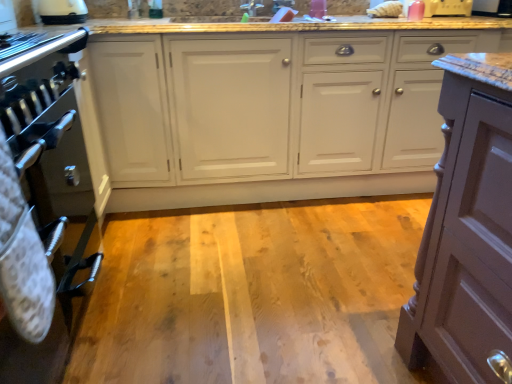
Question: Is metallic oven at left not close to white glossy faucet at upper center?

Choices:
 (A) yes
 (B) no

Answer: (A)

Question: Is metallic oven at left bigger than white glossy faucet at upper center?

Choices:
 (A) no
 (B) yes

Answer: (B)

Question: Does metallic oven at left have a lesser height compared to white glossy faucet at upper center?

Choices:
 (A) no
 (B) yes

Answer: (A)

Question: Could you tell me if metallic oven at left is turned towards white glossy faucet at upper center?

Choices:
 (A) no
 (B) yes

Answer: (A)

Question: From the image's perspective, is metallic oven at left on top of white glossy faucet at upper center?

Choices:
 (A) no
 (B) yes

Answer: (A)

Question: Is metallic oven at left completely or partially outside of white glossy faucet at upper center?

Choices:
 (A) yes
 (B) no

Answer: (A)

Question: Is white glossy cabinets at center not near wooden floor at center?

Choices:
 (A) no
 (B) yes

Answer: (A)

Question: Is white glossy cabinets at center positioned behind wooden floor at center?

Choices:
 (A) yes
 (B) no

Answer: (A)

Question: Considering the relative sizes of white glossy cabinets at center and wooden floor at center in the image provided, is white glossy cabinets at center bigger than wooden floor at center?

Choices:
 (A) no
 (B) yes

Answer: (B)

Question: Can you confirm if white glossy cabinets at center is positioned to the left of wooden floor at center?

Choices:
 (A) no
 (B) yes

Answer: (A)

Question: Is white glossy cabinets at center looking in the opposite direction of wooden floor at center?

Choices:
 (A) no
 (B) yes

Answer: (A)

Question: From the image's perspective, is white glossy cabinets at center over wooden floor at center?

Choices:
 (A) yes
 (B) no

Answer: (A)

Question: Considering the relative positions of metallic oven at left and black glossy microwave at upper right, the 1th appliance in the right-to-left sequence, in the image provided, is metallic oven at left to the left of black glossy microwave at upper right, the 1th appliance in the right-to-left sequence, from the viewer's perspective?

Choices:
 (A) no
 (B) yes

Answer: (B)